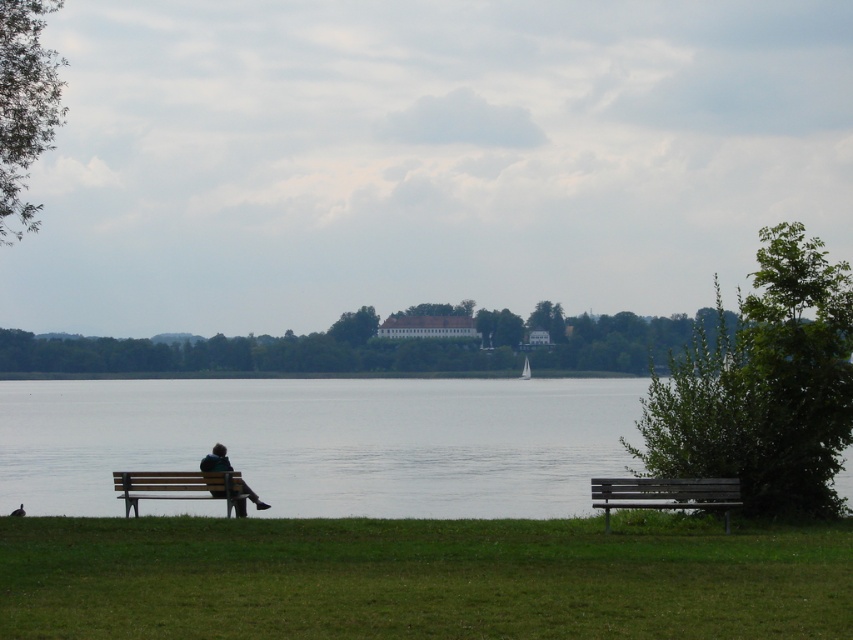
You are a visitor at the lakeside and want to sit on the wooden bench at lower right. Is the transparent water at lower center in a position that might get your feet wet if you sit there?

The transparent water at lower center is positioned under the wooden bench at lower right, so sitting on the wooden bench at lower right would place your feet near the water, potentially getting them wet.

You are standing at the lakeside and want to determine which of the two points, point (195, 476) or point (242, 483), is nearer to you. Based on the scene, which point is closer?

Point (195, 476) is closer to the camera than point (242, 483), so it is the nearer one.

You are standing at the edge of the lake and want to reach the wooden bench at lower left without getting your feet wet. The transparent water at lower center is in your way. What is the shortest distance you need to walk around the water to reach the bench?

The shortest distance you need to walk around the transparent water at lower center to reach the wooden bench at lower left is 15.71 meters.